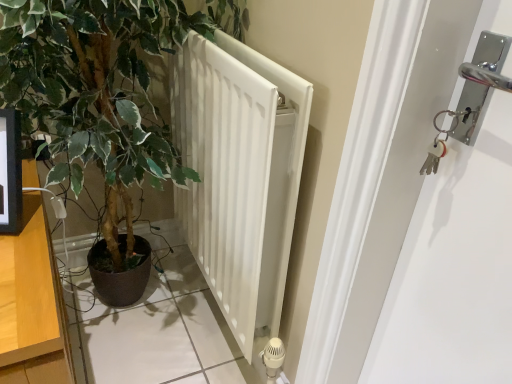
Question: Does wooden dresser at left contain white matte radiator at center?

Choices:
 (A) yes
 (B) no

Answer: (B)

Question: Is wooden dresser at left next to white matte radiator at center and touching it?

Choices:
 (A) yes
 (B) no

Answer: (B)

Question: From the image's perspective, would you say wooden dresser at left is positioned over white matte radiator at center?

Choices:
 (A) yes
 (B) no

Answer: (B)

Question: Can you confirm if wooden dresser at left is thinner than white matte radiator at center?

Choices:
 (A) no
 (B) yes

Answer: (A)

Question: Can you confirm if wooden dresser at left is smaller than white matte radiator at center?

Choices:
 (A) no
 (B) yes

Answer: (B)

Question: From a real-world perspective, relative to green leafy plant at center, is wooden dresser at left vertically above or below?

Choices:
 (A) below
 (B) above

Answer: (A)

Question: In terms of height, does wooden dresser at left look taller or shorter compared to green leafy plant at center?

Choices:
 (A) tall
 (B) short

Answer: (B)

Question: In the image, is wooden dresser at left positioned in front of or behind green leafy plant at center?

Choices:
 (A) front
 (B) behind

Answer: (A)

Question: In terms of width, does wooden dresser at left look wider or thinner when compared to green leafy plant at center?

Choices:
 (A) thin
 (B) wide

Answer: (B)

Question: From the image's perspective, is wooden dresser at left positioned above or below white matte radiator at center?

Choices:
 (A) above
 (B) below

Answer: (B)

Question: Would you say wooden dresser at left is inside or outside white matte radiator at center?

Choices:
 (A) inside
 (B) outside

Answer: (B)

Question: Is wooden dresser at left bigger or smaller than white matte radiator at center?

Choices:
 (A) big
 (B) small

Answer: (B)

Question: From a real-world perspective, is wooden dresser at left positioned above or below white matte radiator at center?

Choices:
 (A) below
 (B) above

Answer: (A)

Question: Based on their positions, is green leafy plant at center located to the left or right of white matte radiator at center?

Choices:
 (A) left
 (B) right

Answer: (A)

Question: Is point (67, 140) positioned closer to the camera than point (233, 92)?

Choices:
 (A) closer
 (B) farther

Answer: (B)